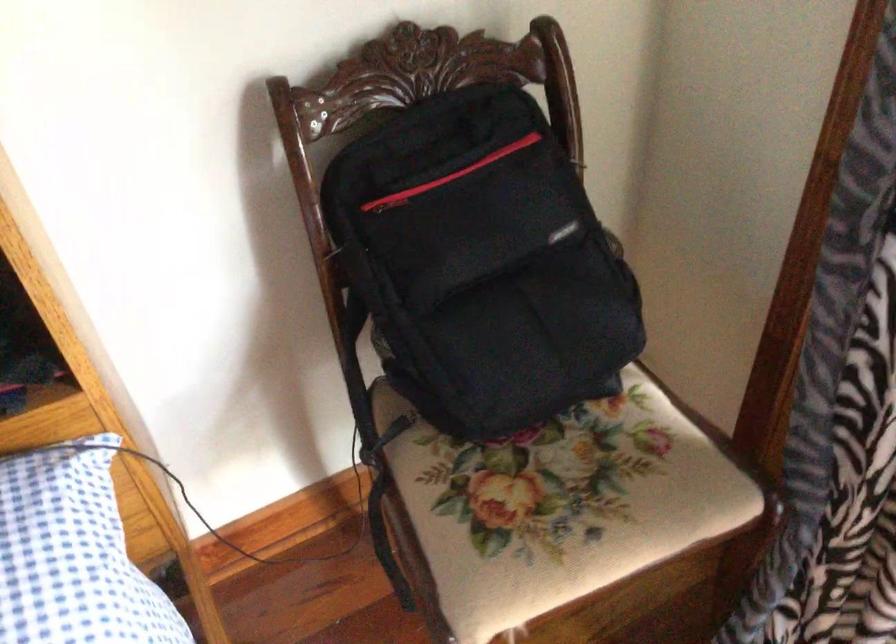
I want to click on red zipper pull, so point(389,202).